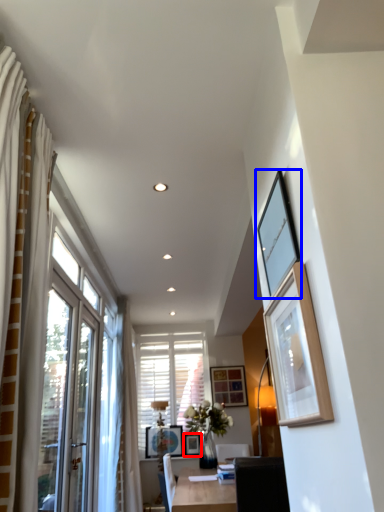
Question: Which of the following is the closest to the observer, picture frame (highlighted by a red box) or picture frame (highlighted by a blue box)?

Choices:
 (A) picture frame
 (B) picture frame

Answer: (B)